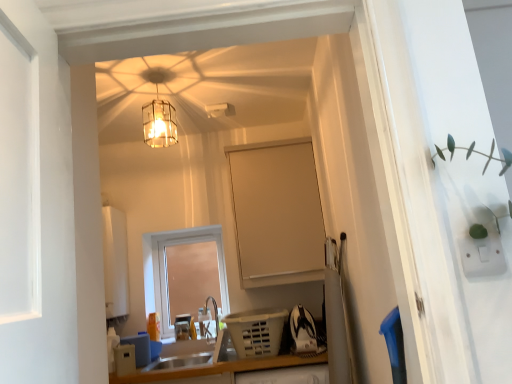
Question: Should I look upward or downward to see translucent glass lampshade at upper center?

Choices:
 (A) up
 (B) down

Answer: (A)

Question: Considering the relative positions of white plastic speaker at lower left, the 1th appliance viewed from the left, and satin silver sink at lower center in the image provided, is white plastic speaker at lower left, the 1th appliance viewed from the left, behind satin silver sink at lower center?

Choices:
 (A) no
 (B) yes

Answer: (A)

Question: From a real-world perspective, is white plastic speaker at lower left, the 2th appliance when ordered from right to left, on top of satin silver sink at lower center?

Choices:
 (A) no
 (B) yes

Answer: (B)

Question: Is white plastic speaker at lower left, the 2th appliance when ordered from right to left, thinner than satin silver sink at lower center?

Choices:
 (A) no
 (B) yes

Answer: (B)

Question: Is white plastic speaker at lower left, the 2th appliance when ordered from right to left, surrounding satin silver sink at lower center?

Choices:
 (A) yes
 (B) no

Answer: (B)

Question: Are white plastic speaker at lower left, the 1th appliance viewed from the left, and satin silver sink at lower center far apart?

Choices:
 (A) yes
 (B) no

Answer: (B)

Question: Is white plastic speaker at lower left, the 2th appliance when ordered from right to left, wider than satin silver sink at lower center?

Choices:
 (A) yes
 (B) no

Answer: (B)

Question: Can you confirm if satin silver sink at lower center is positioned to the right of white plastic speaker at lower left, the 2th appliance when ordered from right to left?

Choices:
 (A) no
 (B) yes

Answer: (B)

Question: Is the surface of satin silver sink at lower center in direct contact with white plastic speaker at lower left, the 1th appliance viewed from the left?

Choices:
 (A) no
 (B) yes

Answer: (A)

Question: Is satin silver sink at lower center positioned behind white plastic speaker at lower left, the 1th appliance viewed from the left?

Choices:
 (A) yes
 (B) no

Answer: (A)

Question: Does satin silver sink at lower center have a larger size compared to white plastic speaker at lower left, the 1th appliance viewed from the left?

Choices:
 (A) yes
 (B) no

Answer: (A)

Question: From the image's perspective, would you say satin silver sink at lower center is positioned over white plastic speaker at lower left, the 2th appliance when ordered from right to left?

Choices:
 (A) yes
 (B) no

Answer: (B)

Question: Is satin silver sink at lower center at the left side of white plastic speaker at lower left, the 1th appliance viewed from the left?

Choices:
 (A) no
 (B) yes

Answer: (A)

Question: Does matte white window at center have a greater width compared to satin silver sink at lower center?

Choices:
 (A) no
 (B) yes

Answer: (A)